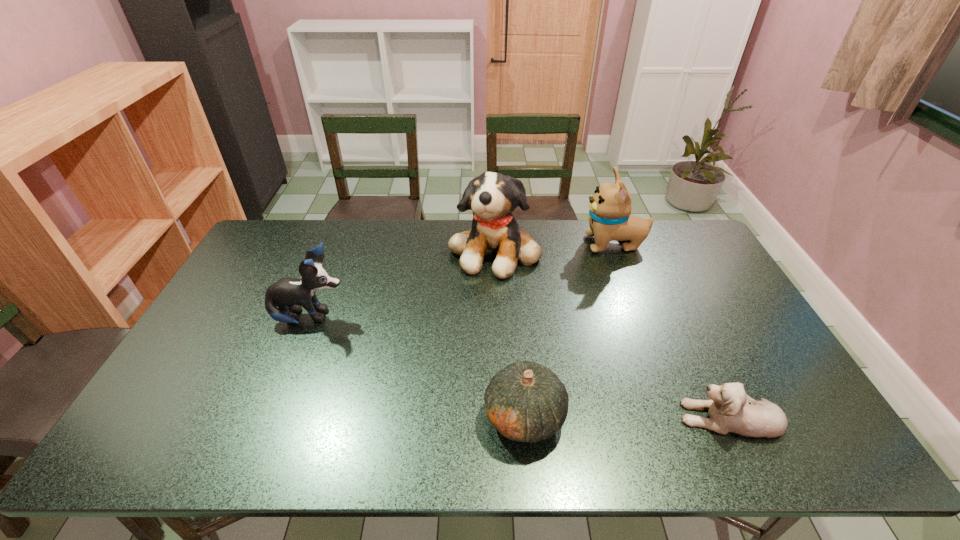
I want to click on the fourth closest object to the gourd, so click(x=610, y=219).

You are a GUI agent. You are given a task and a screenshot of the screen. Output one action in this format:
    pyautogui.click(x=<x>, y=<y>)
    Task: Click on the third closest object to the gourd
    The image size is (960, 540).
    Given the screenshot: What is the action you would take?
    pyautogui.click(x=289, y=294)

Choose which puppy is the second nearest neighbor to the third puppy from right to left. Please provide its 2D coordinates. Your answer should be formatted as a tuple, i.e. [(x, y)], where the tuple contains the x and y coordinates of a point satisfying the conditions above.

[(289, 294)]

Identify the location of puppy that is the second closest one to the gourd. The image size is (960, 540). (492, 197).

In order to click on free space in the image that satisfies the following two spatial constraints: 1. on the front-facing side of the leftmost object; 2. on the left side of the gourd in this screenshot , I will do `click(272, 416)`.

This screenshot has width=960, height=540. In order to click on free space that satisfies the following two spatial constraints: 1. on the front-facing side of the leftmost puppy; 2. on the right side of the gourd in this screenshot , I will do `click(272, 416)`.